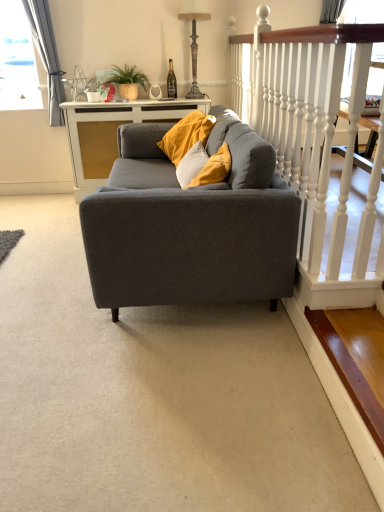
Locate an element on the screen. This screenshot has height=512, width=384. vacant space in front of matte gray couch at center is located at coordinates (150, 389).